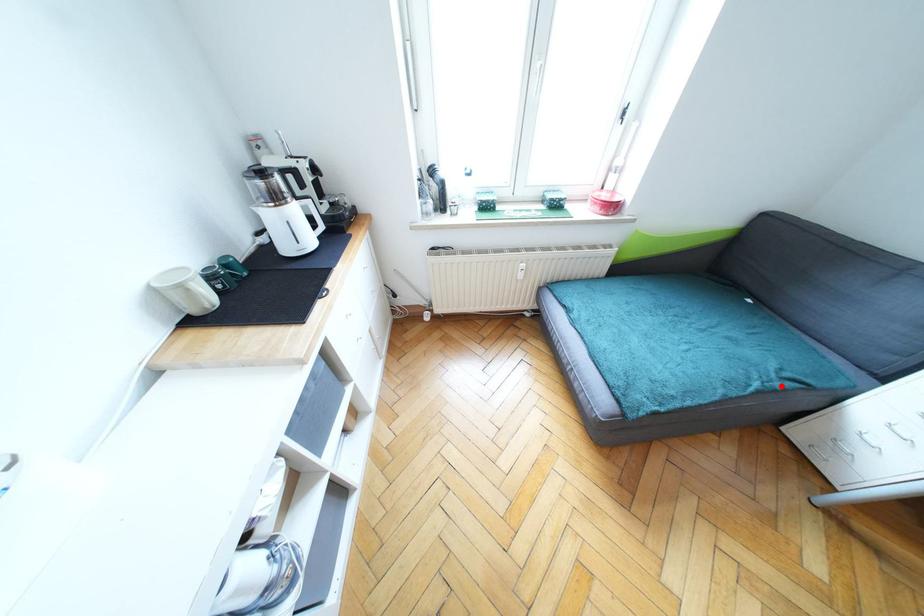
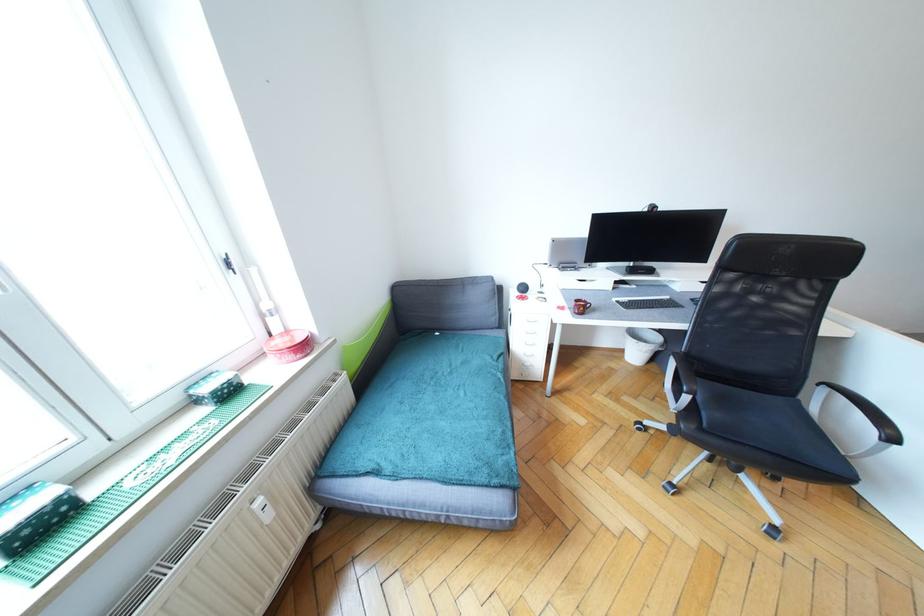
In the second image, find the point that corresponds to the highlighted location in the first image.

(504, 367)